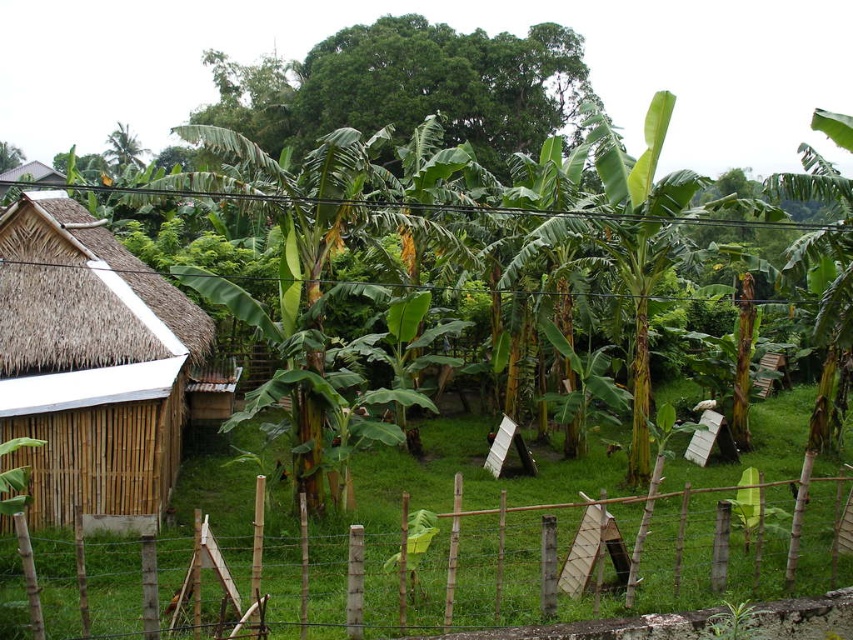
Consider the image. Between bamboo-thatched hut at left and thatched bamboo hut at left, which one is positioned higher?

thatched bamboo hut at left

Is bamboo-thatched hut at left shorter than thatched bamboo hut at left?

Indeed, bamboo-thatched hut at left has a lesser height compared to thatched bamboo hut at left.

The image size is (853, 640). What are the coordinates of `bamboo-thatched hut at left` in the screenshot? It's located at (90, 362).

Identify the location of bamboo-thatched hut at left. The image size is (853, 640). (x=90, y=362).

Which is more to the left, bamboo fence at center or thatched bamboo hut at left?

Positioned to the left is thatched bamboo hut at left.

This screenshot has height=640, width=853. What do you see at coordinates (553, 564) in the screenshot?
I see `bamboo fence at center` at bounding box center [553, 564].

You are a GUI agent. You are given a task and a screenshot of the screen. Output one action in this format:
    pyautogui.click(x=<x>, y=<y>)
    Task: Click on the bamboo fence at center
    This screenshot has height=640, width=853.
    Given the screenshot: What is the action you would take?
    pyautogui.click(x=553, y=564)

This screenshot has height=640, width=853. Find the location of `bamboo fence at center`. bamboo fence at center is located at coordinates (553, 564).

Can you confirm if bamboo fence at center is thinner than bamboo-thatched hut at left?

No, bamboo fence at center is not thinner than bamboo-thatched hut at left.

Measure the distance between bamboo fence at center and camera.

bamboo fence at center is 25.94 feet from camera.

Who is more forward, (660,568) or (169,296)?

Positioned in front is point (660,568).

Find the location of `bamboo fence at center`. bamboo fence at center is located at coordinates (553, 564).